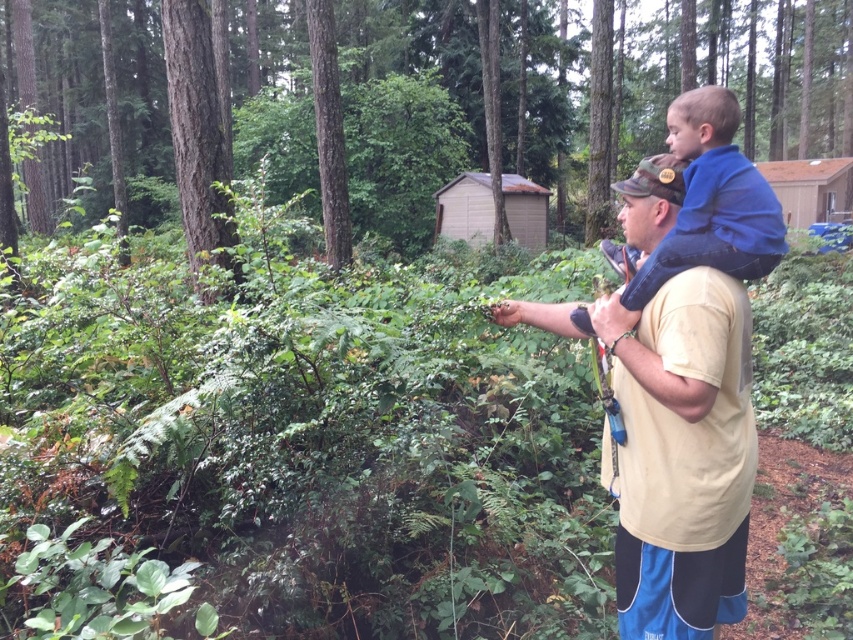
Between tan cotton shirt at center and blue fleece at upper right, which one appears on the left side from the viewer's perspective?

Positioned to the left is tan cotton shirt at center.

Which is behind, point (637, 193) or point (712, 112)?

The point (637, 193) is behind.

Is point (627, 529) farther from viewer compared to point (763, 198)?

That is True.

Locate an element on the screen. This screenshot has height=640, width=853. tan cotton shirt at center is located at coordinates (674, 448).